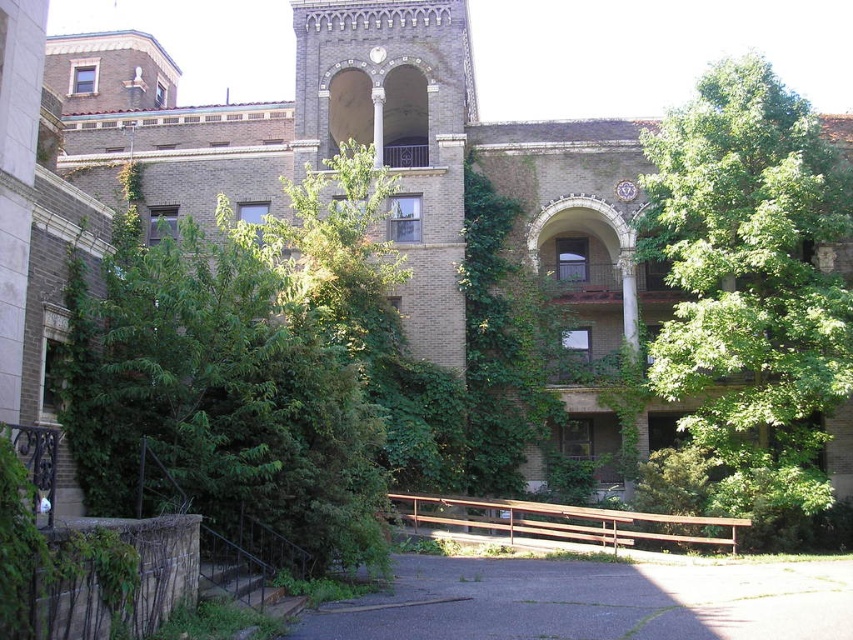
You are standing at the base of the stairs with black railings on the left side of the building. You want to walk to the green leafy tree at upper right. Which direction should you go relative to the green leafy tree at center?

The green leafy tree at center is 82.76 feet away from the green leafy tree at upper right. To reach the green leafy tree at upper right from the stairs, you should move away from the green leafy tree at center since they are positioned apart by that distance.

You are standing at the base of the building and want to reach the point marked as point (263, 352). If your walking speed is 1.5 meters per second, how long will it take you to reach that point?

The distance between you and point (263, 352) is 38.14 meters. At a speed of 1.5 meters per second, it will take approximately 25.43 seconds to reach the point.